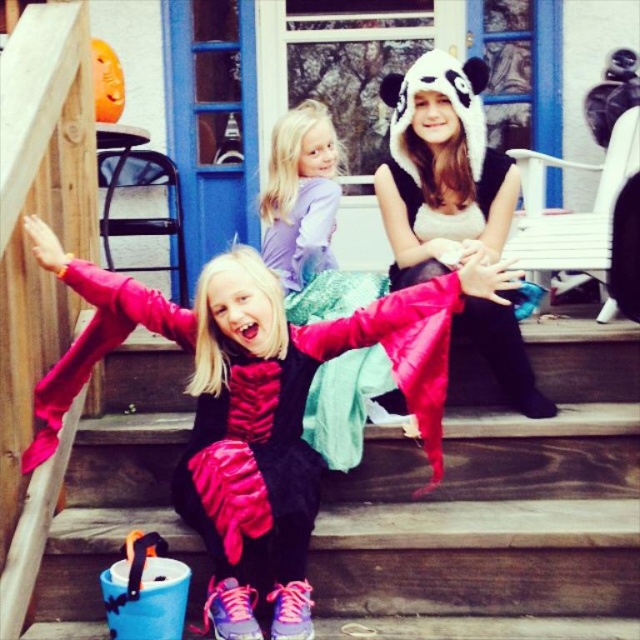
Question: Among these objects, which one is nearest to the camera?

Choices:
 (A) purple satin dress at center
 (B) wooden stairs at lower center

Answer: (B)

Question: Which point is farther to the camera?

Choices:
 (A) wooden stairs at lower center
 (B) purple satin dress at center

Answer: (B)

Question: Can you confirm if wooden stairs at lower center is positioned above purple satin dress at center?

Choices:
 (A) yes
 (B) no

Answer: (B)

Question: Is wooden stairs at lower center thinner than purple satin dress at center?

Choices:
 (A) yes
 (B) no

Answer: (B)

Question: Can you confirm if wooden stairs at lower center is positioned below purple satin dress at center?

Choices:
 (A) yes
 (B) no

Answer: (A)

Question: Which point is closer to the camera?

Choices:
 (A) (320, 177)
 (B) (332, 525)

Answer: (B)